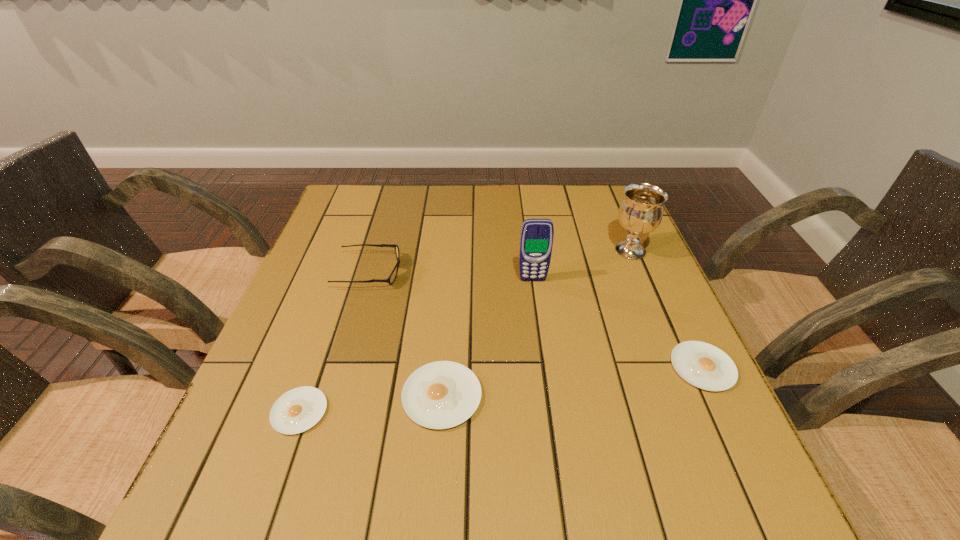
You are a GUI agent. You are given a task and a screenshot of the screen. Output one action in this format:
    pyautogui.click(x=<x>, y=<y>)
    Task: Click on the blank region between the fourth object from left to right and the fourth shortest object
    The height and width of the screenshot is (540, 960).
    Given the screenshot: What is the action you would take?
    pyautogui.click(x=451, y=276)

At what (x,y) coordinates should I click in order to perform the action: click on unoccupied area between the chalice and the cellular telephone. Please return your answer as a coordinate pair (x, y). This screenshot has width=960, height=540. Looking at the image, I should click on (582, 265).

Identify the location of unoccupied position between the rightmost egg yolk and the shortest object. (501, 389).

The image size is (960, 540). Find the location of `free area in between the shortest object and the second egg yolk from right to left`. free area in between the shortest object and the second egg yolk from right to left is located at coordinates (371, 403).

Find the location of `free spot between the chalice and the shortest egg yolk`. free spot between the chalice and the shortest egg yolk is located at coordinates (465, 331).

Identify which object is the fifth closest to the chalice. Please provide its 2D coordinates. Your answer should be formatted as a tuple, i.e. [(x, y)], where the tuple contains the x and y coordinates of a point satisfying the conditions above.

[(299, 409)]

Choose which object is the third nearest neighbor to the chalice. Please provide its 2D coordinates. Your answer should be formatted as a tuple, i.e. [(x, y)], where the tuple contains the x and y coordinates of a point satisfying the conditions above.

[(443, 394)]

Identify the location of egg yolk that is the second closest to the shortest egg yolk. (703, 365).

Select which egg yolk appears as the second closest to the tallest egg yolk. Please provide its 2D coordinates. Your answer should be formatted as a tuple, i.e. [(x, y)], where the tuple contains the x and y coordinates of a point satisfying the conditions above.

[(703, 365)]

This screenshot has width=960, height=540. In order to click on vacant space that satisfies the following two spatial constraints: 1. on the back side of the second shortest object; 2. on the left side of the shortest object in this screenshot , I will do `click(315, 367)`.